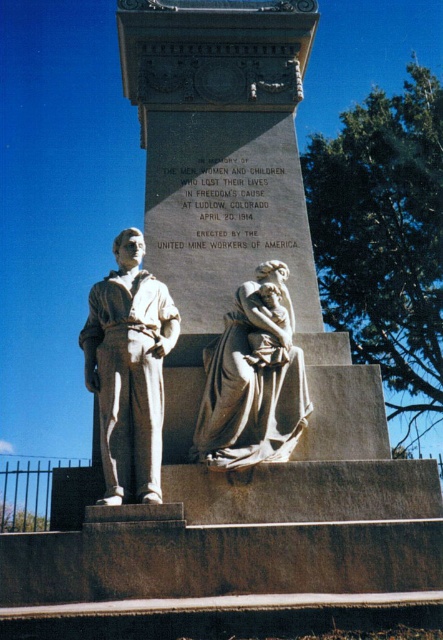
Can you confirm if matte gray statue at left is thinner than matte gray stone sculpture at center?

Yes.

The width and height of the screenshot is (443, 640). Describe the element at coordinates (128, 371) in the screenshot. I see `matte gray statue at left` at that location.

Is point (108, 323) behind point (280, 300)?

No, it is in front of (280, 300).

Identify the location of matte gray statue at left. The image size is (443, 640). (128, 371).